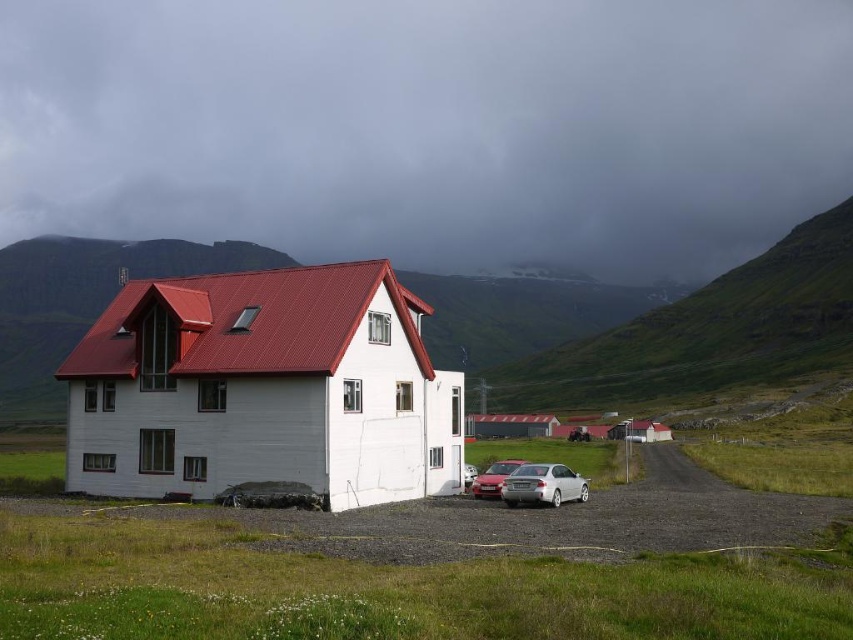
You are a delivery person standing at the edge of the driveway near the white house with a red roof. You need to park your delivery van between the silver metallic car at lower center and the satin silver sedan at lower center. The van is 2.5 meters long. Is there enough space between them to park your van?

The silver metallic car at lower center and the satin silver sedan at lower center are 2.31 meters apart. Since the van is 2.5 meters long, there isn not enough space between them to park the van.

You are standing at the point labeled point (492, 493) and want to walk to the white house with a red corrugated metal roof. Which direction should you go to avoid the point labeled point (576, 480)?

To reach the white house with a red corrugated metal roof while avoiding the point labeled point (576, 480), you should move away from point (576, 480). Since point (576, 480) is in front of point (492, 493), moving backward or to the side would help avoid it.